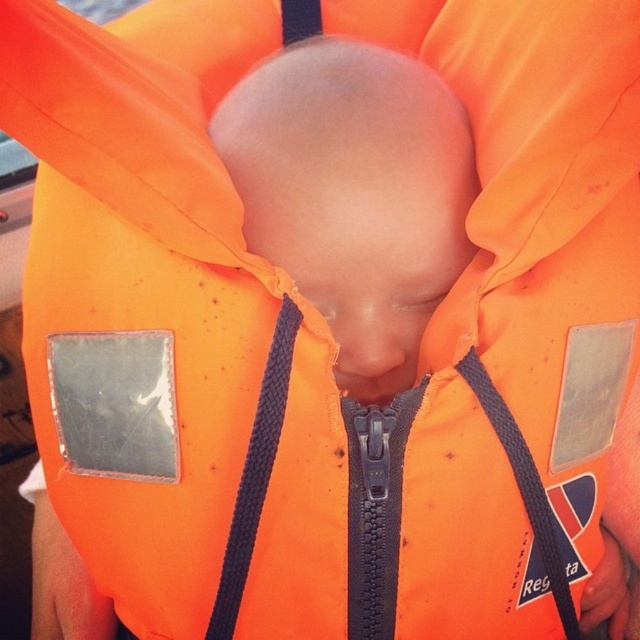
Question: Which of the following is the closest to the observer?

Choices:
 (A) (536, 524)
 (B) (339, 289)

Answer: (B)

Question: Which point is farther to the camera?

Choices:
 (A) smooth skin head at center
 (B) black fabric strap at center
 (C) black braided strap at center

Answer: (A)

Question: From the image, what is the correct spatial relationship of smooth skin head at center in relation to black fabric strap at center?

Choices:
 (A) right
 (B) left

Answer: (B)

Question: Which object appears closest to the camera in this image?

Choices:
 (A) black braided strap at center
 (B) black fabric strap at center

Answer: (A)

Question: Can you confirm if smooth skin head at center is smaller than black braided strap at center?

Choices:
 (A) yes
 (B) no

Answer: (B)

Question: In this image, where is black braided strap at center located relative to black fabric strap at center?

Choices:
 (A) right
 (B) left

Answer: (B)